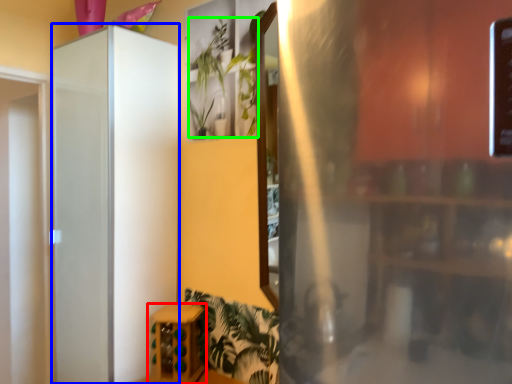
Question: Which object is the farthest from furniture (highlighted by a red box)? Choose among these: screen door (highlighted by a blue box) or plant (highlighted by a green box).

Choices:
 (A) screen door
 (B) plant

Answer: (B)